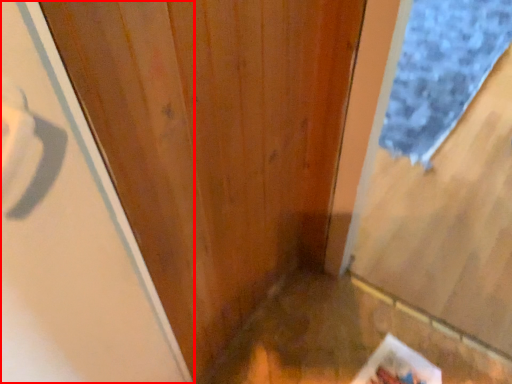
Question: Where is screen door (annotated by the red box) located in relation to doormat in the image?

Choices:
 (A) left
 (B) right

Answer: (A)